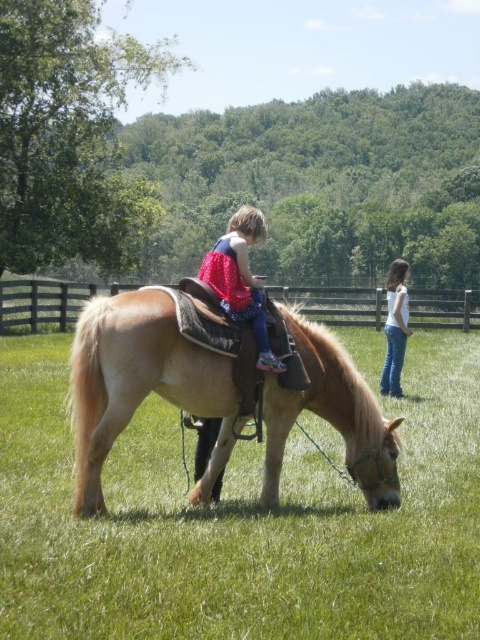
Who is positioned more to the right, green grassy field at center or white denim jeans at right?

white denim jeans at right

How far apart are green grassy field at center and white denim jeans at right?

green grassy field at center is 15.17 feet from white denim jeans at right.

Which is in front, point (444, 621) or point (405, 296)?

Point (444, 621) is more forward.

You are a GUI agent. You are given a task and a screenshot of the screen. Output one action in this format:
    pyautogui.click(x=<x>, y=<y>)
    Task: Click on the green grassy field at center
    This screenshot has width=480, height=640.
    Given the screenshot: What is the action you would take?
    pyautogui.click(x=239, y=522)

Does light brown leather horse at center have a larger size compared to matte pink dress at center?

Correct, light brown leather horse at center is larger in size than matte pink dress at center.

Between point (271, 381) and point (264, 333), which one is positioned in front?

Point (264, 333) is in front.

Locate an element on the screen. light brown leather horse at center is located at coordinates (141, 385).

Between point (260, 304) and point (394, 304), which one is positioned behind?

The point (394, 304) is more distant.

Who is positioned more to the right, matte pink dress at center or white denim jeans at right?

Positioned to the right is white denim jeans at right.

Who is more forward, [219,291] or [394,356]?

Point [219,291] is more forward.

I want to click on matte pink dress at center, so point(240,280).